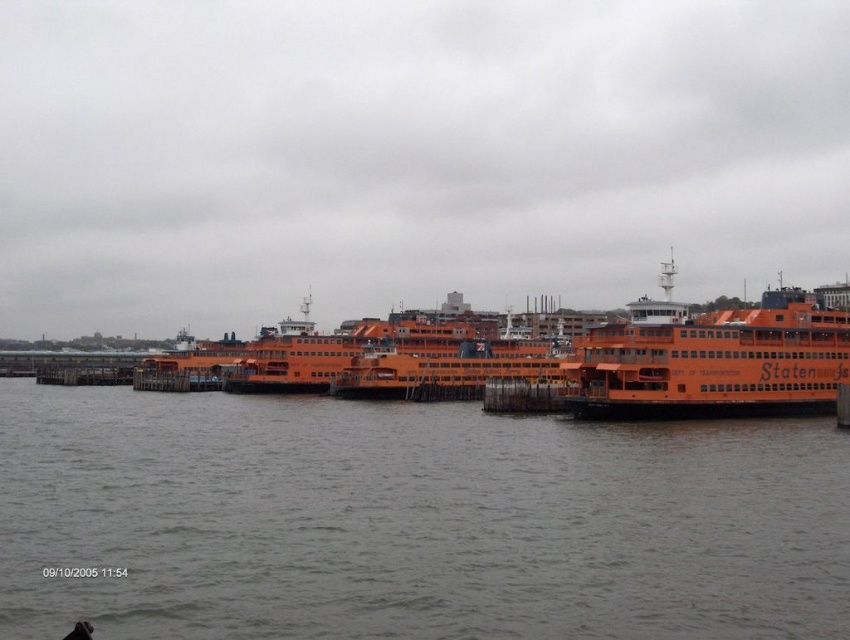
You are a photographer planning to capture the Staten Island Ferry scene. You want to ensure that the gray water at lower center and the orange matte ferry at right are both visible in your shot. Given their sizes, which object should you focus on to include both in the frame without cropping?

The gray water at lower center is larger in size than the orange matte ferry at right. To include both in the frame, focus on the gray water at lower center since it occupies more space, allowing the smaller orange matte ferry at right to fit alongside it.